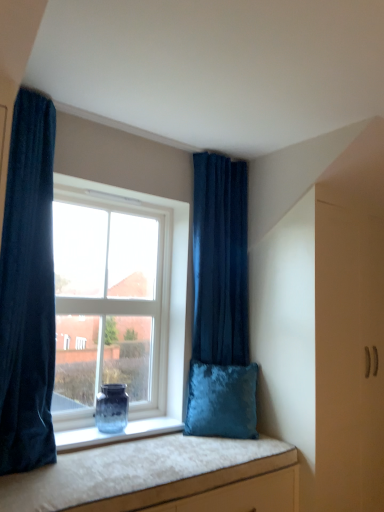
Question: From a real-world perspective, is velvet dark blue curtain at left, arranged as the 1th curtain when viewed from the left, positioned over velvet cushion at lower center based on gravity?

Choices:
 (A) yes
 (B) no

Answer: (A)

Question: Does velvet dark blue curtain at left, positioned as the 1th curtain in front-to-back order, lie behind velvet cushion at lower center?

Choices:
 (A) yes
 (B) no

Answer: (A)

Question: Could you tell me if velvet dark blue curtain at left, which is counted as the second curtain, starting from the right, is facing velvet cushion at lower center?

Choices:
 (A) no
 (B) yes

Answer: (A)

Question: From a real-world perspective, is velvet dark blue curtain at left, positioned as the 1th curtain in front-to-back order, under velvet cushion at lower center?

Choices:
 (A) yes
 (B) no

Answer: (B)

Question: From the image's perspective, is velvet dark blue curtain at left, arranged as the 1th curtain when viewed from the left, under velvet cushion at lower center?

Choices:
 (A) no
 (B) yes

Answer: (A)

Question: In terms of width, does translucent glass vase at window look wider or thinner when compared to velvet cushion at lower center?

Choices:
 (A) wide
 (B) thin

Answer: (B)

Question: Does point (109, 416) appear closer or farther from the camera than point (231, 451)?

Choices:
 (A) farther
 (B) closer

Answer: (A)

Question: From a real-world perspective, relative to velvet cushion at lower center, is translucent glass vase at window vertically above or below?

Choices:
 (A) above
 (B) below

Answer: (A)

Question: Is translucent glass vase at window inside the boundaries of velvet cushion at lower center, or outside?

Choices:
 (A) inside
 (B) outside

Answer: (B)

Question: In the image, is velvet blue pillow at window on the left side or the right side of velvet cushion at lower center?

Choices:
 (A) left
 (B) right

Answer: (B)

Question: Is velvet blue pillow at window in front of or behind velvet cushion at lower center in the image?

Choices:
 (A) behind
 (B) front

Answer: (A)

Question: From their relative heights in the image, would you say velvet blue pillow at window is taller or shorter than velvet cushion at lower center?

Choices:
 (A) tall
 (B) short

Answer: (A)

Question: From a real-world perspective, relative to velvet cushion at lower center, is velvet blue pillow at window vertically above or below?

Choices:
 (A) above
 (B) below

Answer: (A)

Question: Looking at their shapes, would you say velvet dark blue curtain at upper center, which ranks as the 2th curtain in left-to-right order, is wider or thinner than translucent glass vase at window?

Choices:
 (A) thin
 (B) wide

Answer: (B)

Question: Which is correct: velvet dark blue curtain at upper center, the first curtain viewed from the back, is inside translucent glass vase at window, or outside of it?

Choices:
 (A) outside
 (B) inside

Answer: (A)